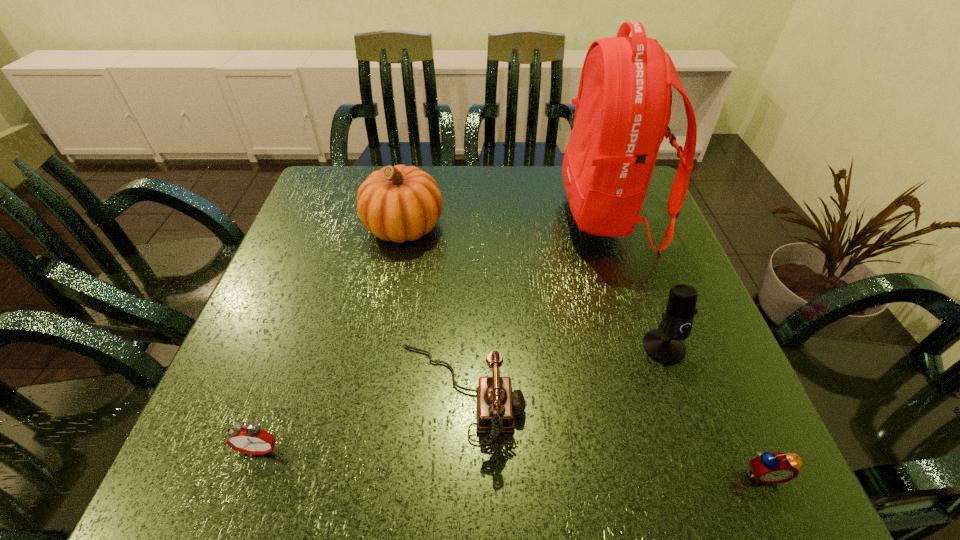
Identify the location of object present at the near left corner. (252, 440).

In order to click on object present at the far right corner in this screenshot , I will do `click(623, 108)`.

The width and height of the screenshot is (960, 540). I want to click on object that is at the near right corner, so click(x=769, y=468).

You are a GUI agent. You are given a task and a screenshot of the screen. Output one action in this format:
    pyautogui.click(x=<x>, y=<y>)
    Task: Click on the free space at the far edge
    
    Given the screenshot: What is the action you would take?
    pyautogui.click(x=558, y=195)

Identify the location of vacant space at the near edge of the desktop. The width and height of the screenshot is (960, 540). (562, 468).

Locate an element on the screen. vacant space at the left edge is located at coordinates (312, 356).

The height and width of the screenshot is (540, 960). Identify the location of free space at the right edge of the desktop. (635, 272).

This screenshot has height=540, width=960. Find the location of `vacant space at the far left corner of the desktop`. vacant space at the far left corner of the desktop is located at coordinates (342, 179).

This screenshot has height=540, width=960. I want to click on vacant region between the pumpkin and the telephone, so click(432, 312).

At what (x,y) coordinates should I click in order to perform the action: click on blank region between the nearer alarm clock and the leftmost object. Please return your answer as a coordinate pair (x, y). Looking at the image, I should click on pos(512,461).